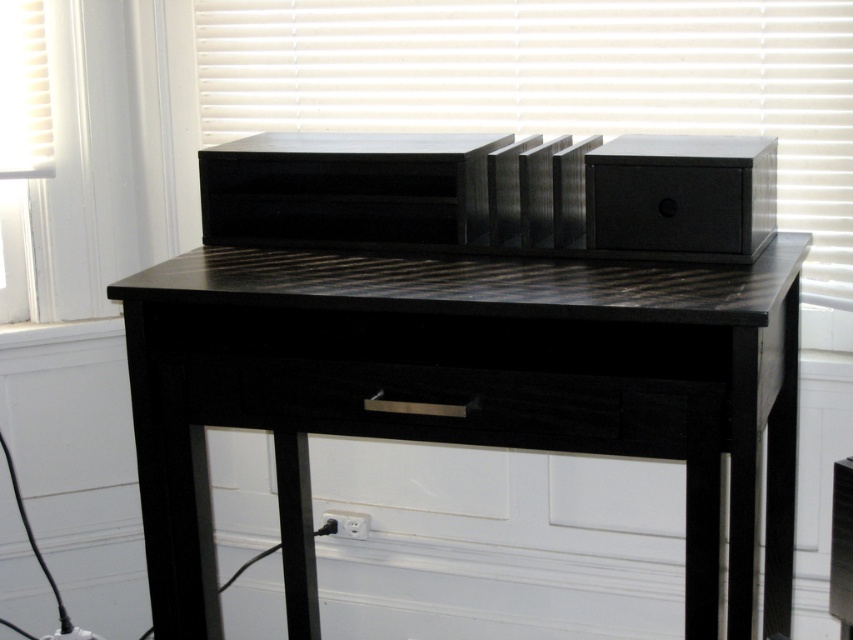
You are standing in a room and see the black wood table at center. If you want to reach an object placed exactly 1.2 meters away from you, can you touch it while standing in your current position?

The black wood table at center is 1.19 meters from viewer, so yes, you can touch the object placed exactly 1.2 meters away as the table is just slightly closer, within reach.

You are setting up an audio system and need to place the matte black speaker at upper center next to the black matte drawer at center. According to the scene, which side of the drawer should you place the speaker?

The matte black speaker at upper center is to the right of the black matte drawer at center, so you should place it on the right side of the drawer.

You are setting up an audio system and need to connect the matte black speaker at upper center to the black matte drawer at center. Since the drawer has a power outlet, will you need to move the speaker to access the outlet?

The black matte drawer at center is behind the matte black speaker at upper center, so you will need to move the speaker to access the outlet on the drawer.